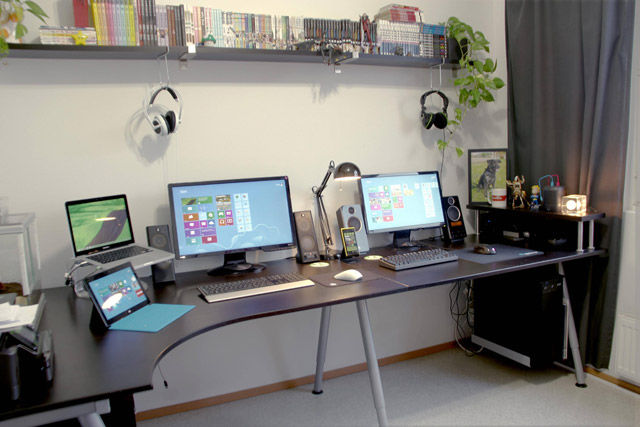
Where is `plant`? plant is located at coordinates (460, 43).